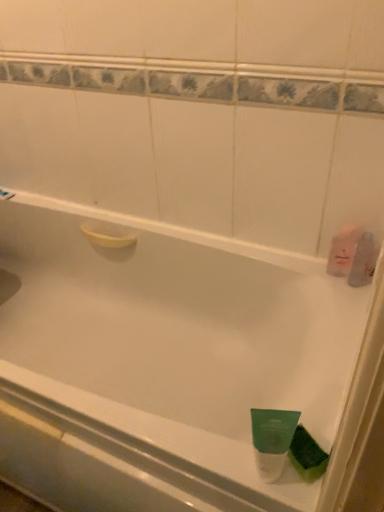
Question: From a real-world perspective, is green matte tube at bottom right, which is the 2th mouthwash in bottom-to-top order, located beneath clear plastic bottle at right, the 2th mouthwash positioned from the top?

Choices:
 (A) yes
 (B) no

Answer: (B)

Question: Is green matte tube at bottom right, which is the 2th mouthwash in bottom-to-top order, taller than clear plastic bottle at right, the fourth mouthwash viewed from the left?

Choices:
 (A) yes
 (B) no

Answer: (A)

Question: Does green matte tube at bottom right, which appears as the first mouthwash when viewed from the front, have a lesser height compared to clear plastic bottle at right, positioned as the 3th mouthwash in bottom-to-top order?

Choices:
 (A) yes
 (B) no

Answer: (B)

Question: Does green matte tube at bottom right, which is the 2th mouthwash in bottom-to-top order, have a smaller size compared to clear plastic bottle at right, the 2th mouthwash positioned from the top?

Choices:
 (A) no
 (B) yes

Answer: (A)

Question: Can you confirm if green matte tube at bottom right, which ranks as the 4th mouthwash in back-to-front order, is bigger than clear plastic bottle at right, the second mouthwash positioned from the back?

Choices:
 (A) no
 (B) yes

Answer: (B)

Question: Would you consider green matte tube at bottom right, placed as the first mouthwash when sorted from left to right, to be distant from clear plastic bottle at right, the 1th mouthwash viewed from the right?

Choices:
 (A) no
 (B) yes

Answer: (A)

Question: Is white glossy shower at upper left wider than green matte tube at bottom right, which is the 3th mouthwash in top-to-bottom order?

Choices:
 (A) no
 (B) yes

Answer: (B)

Question: From a real-world perspective, is white glossy shower at upper left over green matte tube at bottom right, which appears as the first mouthwash when viewed from the front?

Choices:
 (A) no
 (B) yes

Answer: (A)

Question: Is white glossy shower at upper left facing towards green matte tube at bottom right, which is the 3th mouthwash in top-to-bottom order?

Choices:
 (A) no
 (B) yes

Answer: (A)

Question: Is white glossy shower at upper left taller than green matte tube at bottom right, which appears as the first mouthwash when viewed from the front?

Choices:
 (A) no
 (B) yes

Answer: (A)

Question: Considering the relative sizes of white glossy shower at upper left and green matte tube at bottom right, which ranks as the 4th mouthwash in back-to-front order, in the image provided, is white glossy shower at upper left shorter than green matte tube at bottom right, which ranks as the 4th mouthwash in back-to-front order,?

Choices:
 (A) no
 (B) yes

Answer: (B)

Question: Does white glossy shower at upper left touch green matte tube at bottom right, which is the 3th mouthwash in top-to-bottom order?

Choices:
 (A) no
 (B) yes

Answer: (A)

Question: Is pink translucent bottle at right, placed as the fourth mouthwash when sorted from bottom to top, smaller than white glossy shower at upper left?

Choices:
 (A) yes
 (B) no

Answer: (B)